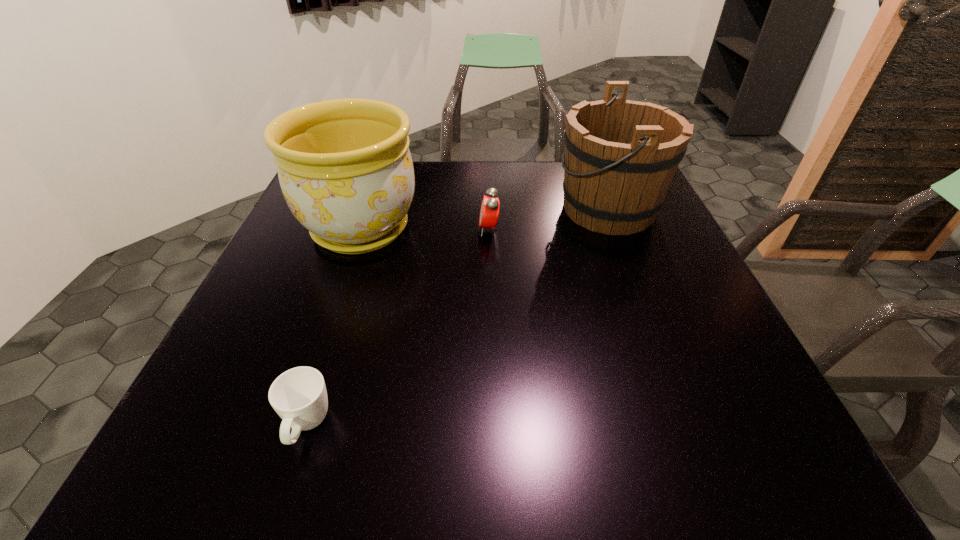
At what (x,y) coordinates should I click in order to perform the action: click on wine bucket. Please return your answer as a coordinate pair (x, y). Looking at the image, I should click on (620, 155).

At what (x,y) coordinates should I click in order to perform the action: click on flowerpot. Please return your answer as a coordinate pair (x, y). The width and height of the screenshot is (960, 540). Looking at the image, I should click on (345, 169).

This screenshot has width=960, height=540. I want to click on the second shortest object, so click(489, 211).

You are a GUI agent. You are given a task and a screenshot of the screen. Output one action in this format:
    pyautogui.click(x=<x>, y=<y>)
    Task: Click on the third object from left to right
    
    Given the screenshot: What is the action you would take?
    pyautogui.click(x=489, y=211)

Locate an element on the screen. This screenshot has height=540, width=960. the shortest object is located at coordinates (299, 396).

This screenshot has height=540, width=960. Identify the location of the nearest object. (299, 396).

This screenshot has height=540, width=960. I want to click on free space located on the side of the rightmost object with the handle for carrying, so click(482, 209).

Find the location of a particular element. The image size is (960, 540). free spot located 0.170m on the side of the rightmost object with the handle for carrying is located at coordinates (493, 209).

Where is `vacant space located on the side of the rightmost object with the handle for carrying`? Image resolution: width=960 pixels, height=540 pixels. vacant space located on the side of the rightmost object with the handle for carrying is located at coordinates (530, 209).

Find the location of a particular element. The image size is (960, 540). vacant space located 0.100m on the back of the flowerpot is located at coordinates (377, 179).